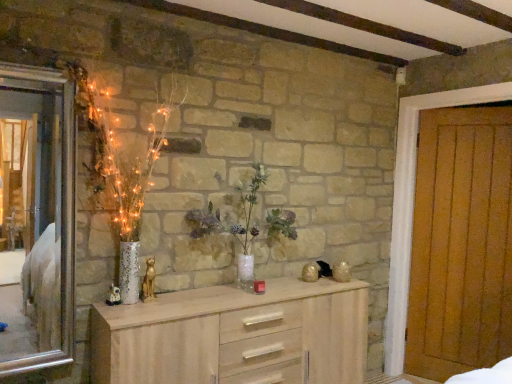
Question: Should I look upward or downward to see light wood chest of drawers at center?

Choices:
 (A) up
 (B) down

Answer: (B)

Question: Does silver metallic mirror at left have a greater width compared to light wood chest of drawers at center?

Choices:
 (A) no
 (B) yes

Answer: (A)

Question: From the image's perspective, is silver metallic mirror at left beneath light wood chest of drawers at center?

Choices:
 (A) no
 (B) yes

Answer: (A)

Question: From a real-world perspective, does silver metallic mirror at left sit lower than light wood chest of drawers at center?

Choices:
 (A) yes
 (B) no

Answer: (B)

Question: Would you consider silver metallic mirror at left to be distant from light wood chest of drawers at center?

Choices:
 (A) yes
 (B) no

Answer: (A)

Question: Does silver metallic mirror at left come behind light wood chest of drawers at center?

Choices:
 (A) yes
 (B) no

Answer: (A)

Question: Is silver metallic mirror at left taller than light wood chest of drawers at center?

Choices:
 (A) yes
 (B) no

Answer: (A)

Question: Can you confirm if wooden door at right is wider than light wood chest of drawers at center?

Choices:
 (A) yes
 (B) no

Answer: (B)

Question: Could you tell me if wooden door at right is turned towards light wood chest of drawers at center?

Choices:
 (A) no
 (B) yes

Answer: (B)

Question: Is wooden door at right completely or partially outside of light wood chest of drawers at center?

Choices:
 (A) no
 (B) yes

Answer: (B)

Question: Is wooden door at right positioned in front of light wood chest of drawers at center?

Choices:
 (A) yes
 (B) no

Answer: (B)

Question: From a real-world perspective, is wooden door at right located beneath light wood chest of drawers at center?

Choices:
 (A) no
 (B) yes

Answer: (A)

Question: Are wooden door at right and light wood chest of drawers at center located far from each other?

Choices:
 (A) no
 (B) yes

Answer: (B)

Question: Can you confirm if translucent glass vase at center is smaller than wooden door at right?

Choices:
 (A) yes
 (B) no

Answer: (A)